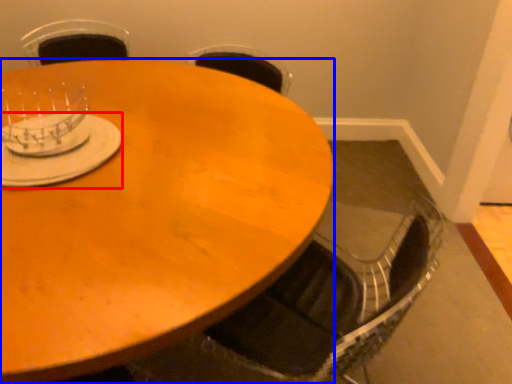
Question: Which of the following is the closest to the observer, tableware (highlighted by a red box) or coffee table (highlighted by a blue box)?

Choices:
 (A) tableware
 (B) coffee table

Answer: (B)